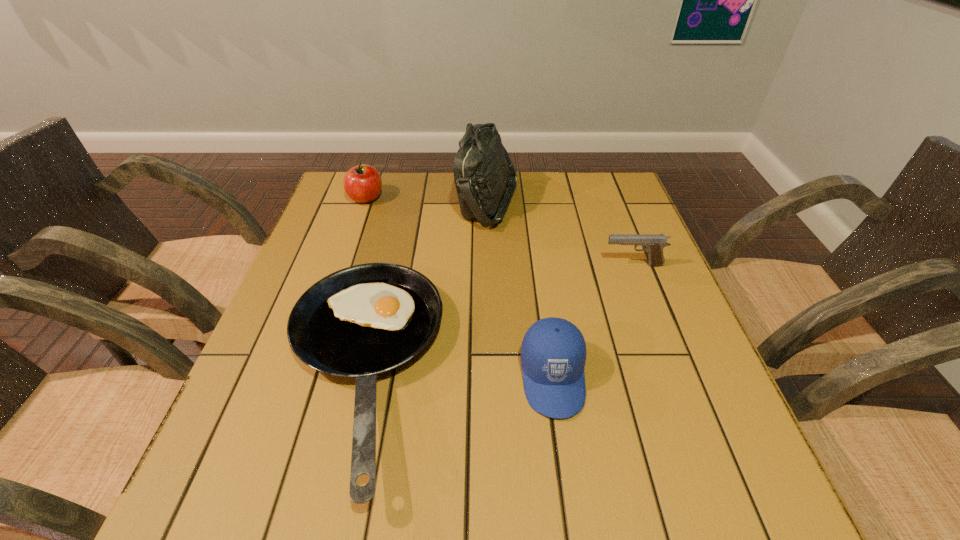
Locate an element on the screen. The width and height of the screenshot is (960, 540). object at the right edge is located at coordinates (653, 244).

At what (x,y) coordinates should I click in order to perform the action: click on object that is at the far left corner. Please return your answer as a coordinate pair (x, y). Looking at the image, I should click on (362, 183).

Locate an element on the screen. Image resolution: width=960 pixels, height=540 pixels. object that is at the near left corner is located at coordinates (364, 320).

Find the location of `vacant region at the far edge of the desktop`. vacant region at the far edge of the desktop is located at coordinates (433, 214).

The height and width of the screenshot is (540, 960). In the image, there is a desktop. Find the location of `free space at the near edge`. free space at the near edge is located at coordinates (556, 522).

This screenshot has width=960, height=540. I want to click on blank space at the left edge of the desktop, so point(353,253).

At what (x,y) coordinates should I click in order to perform the action: click on vacant region at the right edge of the desktop. Please return your answer as a coordinate pair (x, y). Looking at the image, I should click on (734, 438).

The image size is (960, 540). Identify the location of free region at the far left corner of the desktop. (352, 213).

Where is `vacant space at the near left corner`? The height and width of the screenshot is (540, 960). vacant space at the near left corner is located at coordinates (200, 493).

Where is `vacant area that lies between the pistol and the cap`? vacant area that lies between the pistol and the cap is located at coordinates (593, 321).